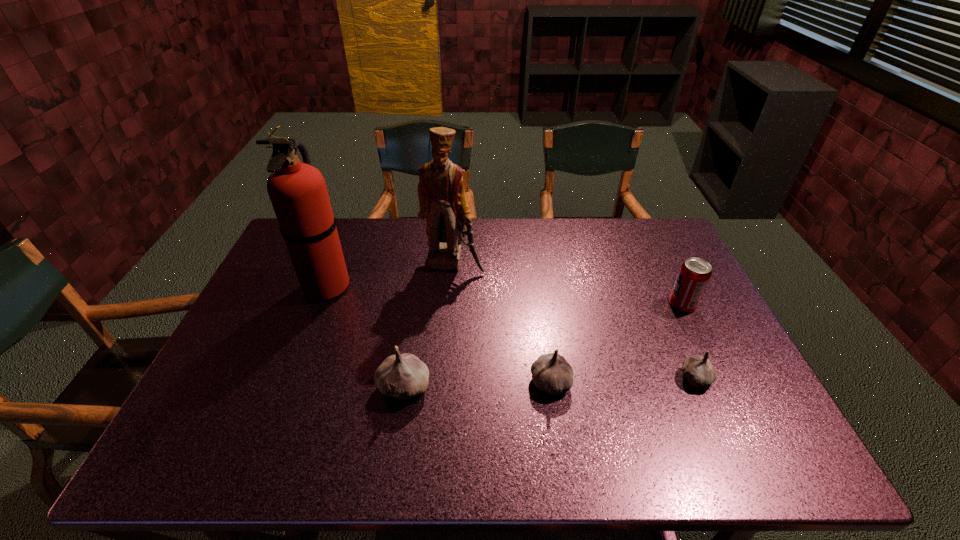
Considering the uniform spacing of garlics, where should an additional garlic be positioned on the left? Please locate a free spot. Please provide its 2D coordinates. Your answer should be formatted as a tuple, i.e. [(x, y)], where the tuple contains the x and y coordinates of a point satisfying the conditions above.

[(253, 392)]